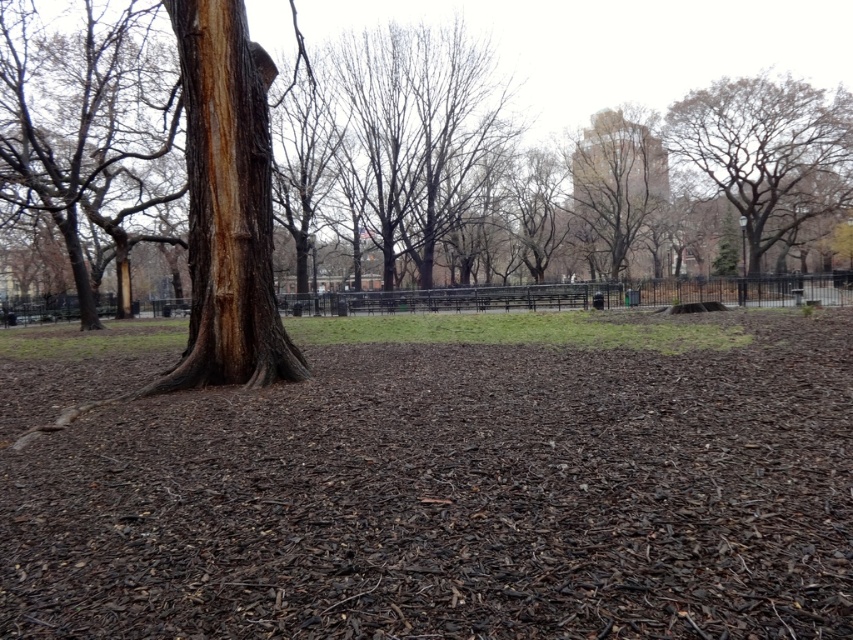
Who is higher up, brown rough bark tree trunk at left or brown rough bark tree at upper center?

Positioned higher is brown rough bark tree at upper center.

Between point (267, 147) and point (613, 248), which one is positioned in front?

Positioned in front is point (267, 147).

Based on the photo, who is more distant from viewer, (218, 204) or (579, 234)?

The point (579, 234) is more distant.

At what (x,y) coordinates should I click in order to perform the action: click on brown rough bark tree trunk at left. Please return your answer as a coordinate pair (x, y). Looking at the image, I should click on (227, 205).

Consider the image. Does brown rough bark tree trunk at left appear on the right side of brown rough bark tree at upper right?

In fact, brown rough bark tree trunk at left is to the left of brown rough bark tree at upper right.

What do you see at coordinates (227, 205) in the screenshot? I see `brown rough bark tree trunk at left` at bounding box center [227, 205].

Does point (198, 204) lie in front of point (846, 106)?

Yes.

Find the location of a particular element. brown rough bark tree trunk at left is located at coordinates (227, 205).

Between rough bark tree at center and brown rough bark tree trunk at left, which one appears on the left side from the viewer's perspective?

brown rough bark tree trunk at left

Does rough bark tree at center lie in front of brown rough bark tree trunk at left?

No, rough bark tree at center is further to the viewer.

Which is behind, point (514, 77) or point (236, 220)?

Positioned behind is point (514, 77).

This screenshot has width=853, height=640. I want to click on rough bark tree at center, so click(x=618, y=45).